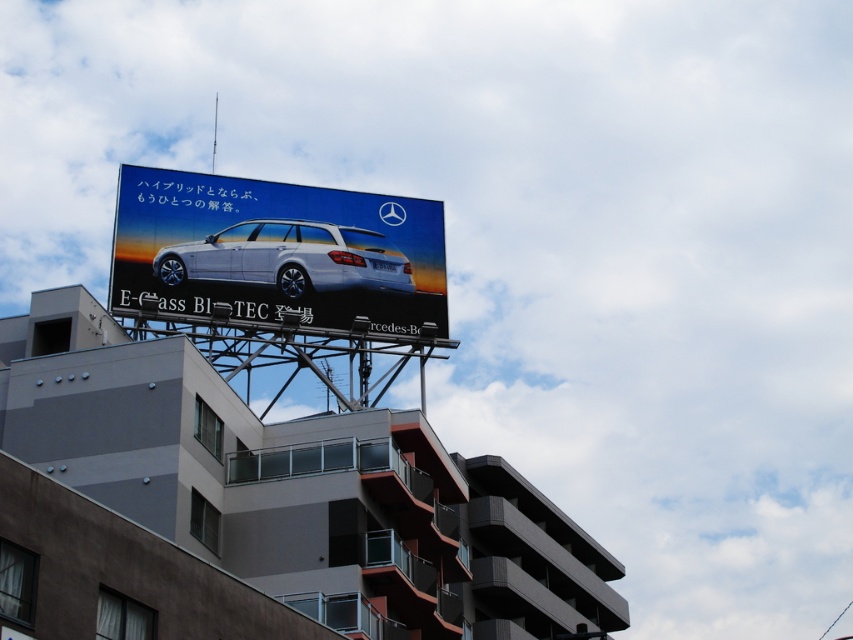
Question: In this image, where is white glossy car at upper center located relative to white glossy wagon at center?

Choices:
 (A) left
 (B) right

Answer: (B)

Question: Is white glossy car at upper center further to camera compared to white glossy wagon at center?

Choices:
 (A) no
 (B) yes

Answer: (A)

Question: Does white glossy car at upper center have a greater width compared to white glossy wagon at center?

Choices:
 (A) no
 (B) yes

Answer: (B)

Question: Which point appears farthest from the camera in this image?

Choices:
 (A) (244, 264)
 (B) (325, 221)

Answer: (B)